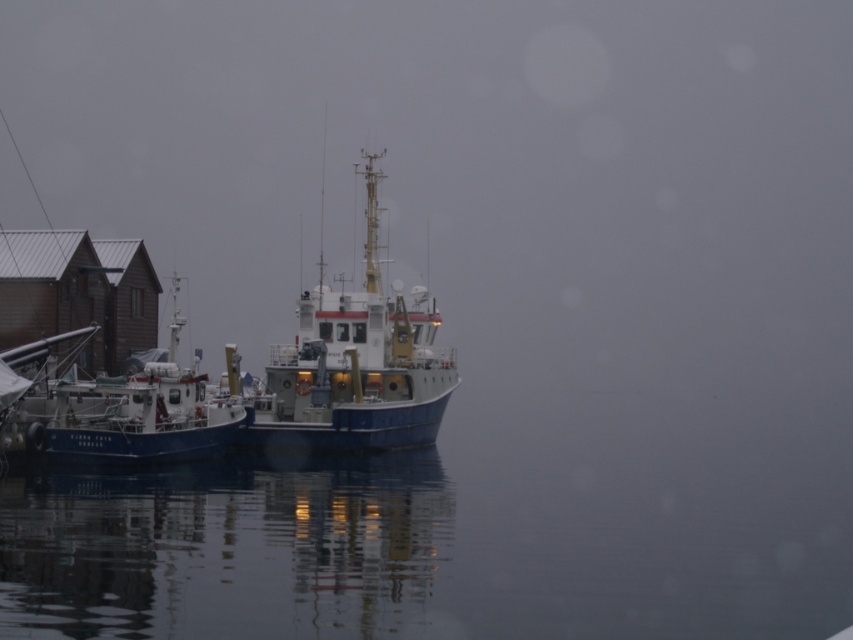
Question: Can you confirm if blue matte boat at center is positioned to the left of blue matte boat at left?

Choices:
 (A) yes
 (B) no

Answer: (B)

Question: Among these objects, which one is nearest to the camera?

Choices:
 (A) blue matte boat at left
 (B) blue matte boat at center

Answer: (A)

Question: Is blue matte boat at center positioned behind blue matte boat at left?

Choices:
 (A) yes
 (B) no

Answer: (A)

Question: Which point is closer to the camera taking this photo?

Choices:
 (A) 375,264
 (B) 229,422

Answer: (B)

Question: In this image, where is blue matte boat at center located relative to blue matte boat at left?

Choices:
 (A) left
 (B) right

Answer: (B)